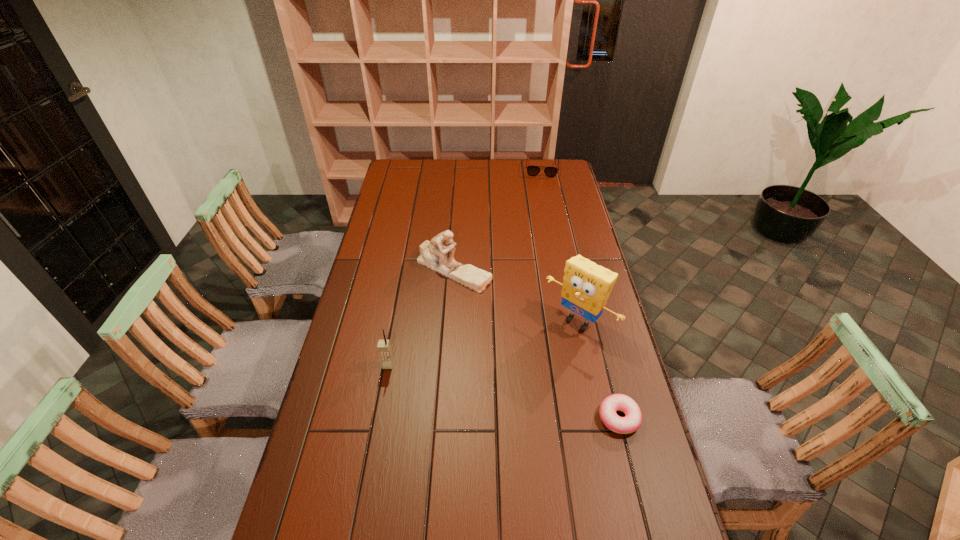
Locate an element on the screen. cellular telephone is located at coordinates (384, 347).

The height and width of the screenshot is (540, 960). What are the coordinates of `the second nearest object` in the screenshot? It's located at (384, 347).

Identify the location of the nearest object. (632, 421).

Locate an element on the screen. The height and width of the screenshot is (540, 960). the shortest object is located at coordinates (632, 421).

Where is `figurine`? This screenshot has height=540, width=960. figurine is located at coordinates (433, 253).

Where is `the fourth nearest object`? Image resolution: width=960 pixels, height=540 pixels. the fourth nearest object is located at coordinates (433, 253).

Image resolution: width=960 pixels, height=540 pixels. Find the location of `spectacles`. spectacles is located at coordinates (531, 170).

This screenshot has width=960, height=540. In order to click on the fourth tallest object in this screenshot , I will do [531, 170].

At what (x,y) coordinates should I click in order to perform the action: click on sponge. Please return your answer as a coordinate pair (x, y). Image resolution: width=960 pixels, height=540 pixels. Looking at the image, I should click on (587, 286).

Where is `the tallest object`? The width and height of the screenshot is (960, 540). the tallest object is located at coordinates (587, 286).